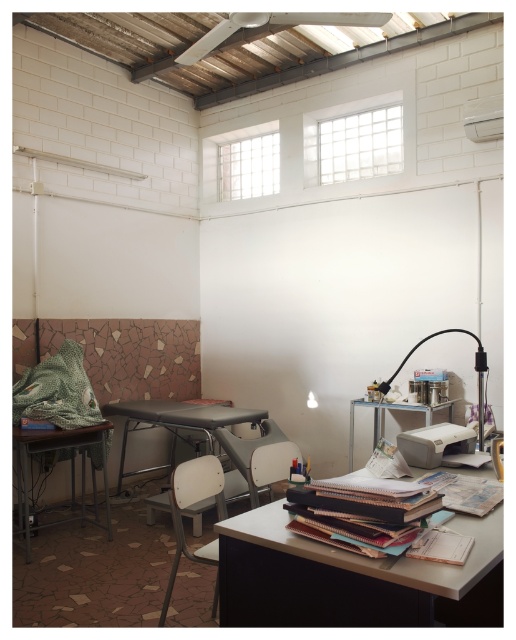
You are standing in the room and see two points marked on the wall. One is at point (237, 456) and the other at point (427, 408). Which point is closer to you?

Point (237, 456) is in front of point (427, 408), so it is closer to you.